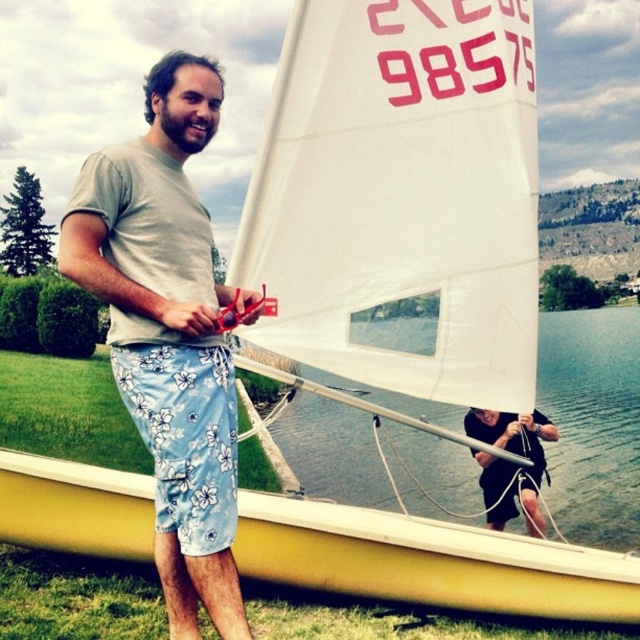
Is yellow plastic canoe at lower left to the right of blue floral shorts at center from the viewer's perspective?

Yes, yellow plastic canoe at lower left is to the right of blue floral shorts at center.

Is point (564, 592) closer to viewer compared to point (189, 380)?

No, it is not.

Identify the location of yellow plastic canoe at lower left. (429, 561).

In order to click on yellow plastic canoe at lower left in this screenshot , I will do `click(429, 561)`.

Does yellow plastic canoe at lower left have a greater height compared to matte black shorts at center?

No, yellow plastic canoe at lower left is not taller than matte black shorts at center.

Does yellow plastic canoe at lower left have a greater width compared to matte black shorts at center?

Indeed, yellow plastic canoe at lower left has a greater width compared to matte black shorts at center.

Who is more distant from viewer, (406, 552) or (484, 460)?

The point (484, 460) is more distant.

At what (x,y) coordinates should I click in order to perform the action: click on yellow plastic canoe at lower left. Please return your answer as a coordinate pair (x, y). This screenshot has width=640, height=640. Looking at the image, I should click on (429, 561).

Which is above, gray cotton t-shirt at center or blue floral shorts at center?

gray cotton t-shirt at center is above.

Can you confirm if gray cotton t-shirt at center is shorter than blue floral shorts at center?

Yes.

Measure the distance between point (160, 324) and camera.

Point (160, 324) is 9.66 meters away from camera.

The width and height of the screenshot is (640, 640). In order to click on gray cotton t-shirt at center in this screenshot , I will do `click(168, 333)`.